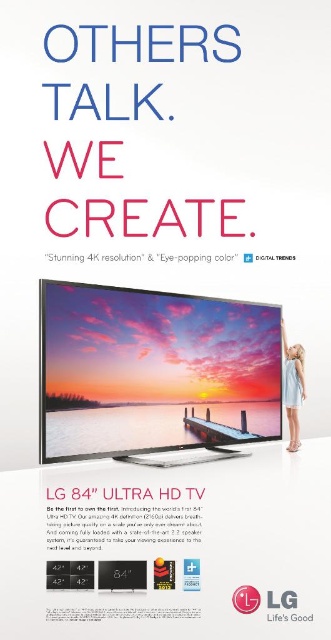
Is light blue fabric dress at lower right taller than white plastic logo at center?

Yes, light blue fabric dress at lower right is taller than white plastic logo at center.

Does point (285, 384) come closer to viewer compared to point (280, 616)?

No, it is not.

Does point (288, 422) come behind point (303, 621)?

That is True.

The image size is (331, 640). Identify the location of light blue fabric dress at lower right. (292, 387).